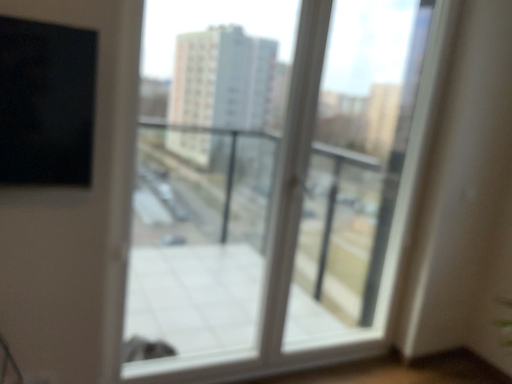
Question: Is transparent glass window at center closer to camera compared to white plastic screen door at center?

Choices:
 (A) no
 (B) yes

Answer: (B)

Question: Is transparent glass window at center aimed at white plastic screen door at center?

Choices:
 (A) no
 (B) yes

Answer: (B)

Question: Is transparent glass window at center far away from white plastic screen door at center?

Choices:
 (A) no
 (B) yes

Answer: (A)

Question: Can you confirm if transparent glass window at center is smaller than white plastic screen door at center?

Choices:
 (A) no
 (B) yes

Answer: (A)

Question: Considering the relative positions of transparent glass window at center and white plastic screen door at center in the image provided, is transparent glass window at center to the right of white plastic screen door at center from the viewer's perspective?

Choices:
 (A) yes
 (B) no

Answer: (B)

Question: Does transparent glass window at center appear on the left side of white plastic screen door at center?

Choices:
 (A) yes
 (B) no

Answer: (A)

Question: Does white plastic screen door at center have a lesser width compared to transparent glass window at center?

Choices:
 (A) yes
 (B) no

Answer: (A)

Question: Is white plastic screen door at center bigger than transparent glass window at center?

Choices:
 (A) yes
 (B) no

Answer: (B)

Question: Is white plastic screen door at center facing away from transparent glass window at center?

Choices:
 (A) yes
 (B) no

Answer: (A)

Question: Is white plastic screen door at center to the right of transparent glass window at center from the viewer's perspective?

Choices:
 (A) yes
 (B) no

Answer: (A)

Question: Is white plastic screen door at center next to transparent glass window at center and touching it?

Choices:
 (A) yes
 (B) no

Answer: (B)

Question: Is white plastic screen door at center shorter than transparent glass window at center?

Choices:
 (A) no
 (B) yes

Answer: (B)

Question: Based on their positions, is transparent glass window at center located to the left or right of white plastic screen door at center?

Choices:
 (A) right
 (B) left

Answer: (B)